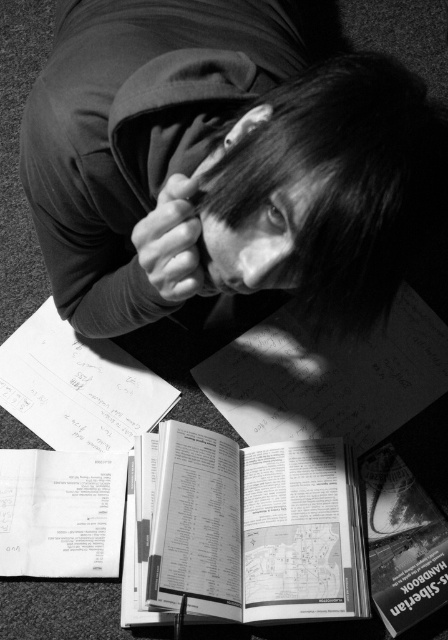
Question: Can you confirm if smooth hair at center is positioned below paperback book at center?

Choices:
 (A) no
 (B) yes

Answer: (A)

Question: Which point is farther to the camera?

Choices:
 (A) smooth skin hand at center
 (B) white paper at lower left
 (C) smooth hair at center
 (D) white paper at center

Answer: (D)

Question: Is white paper at lower left below smooth skin hand at center?

Choices:
 (A) no
 (B) yes

Answer: (B)

Question: Does paperback book at center lie behind white paper at center?

Choices:
 (A) yes
 (B) no

Answer: (B)

Question: Which of the following is the closest to the observer?

Choices:
 (A) smooth hair at center
 (B) white paper at center
 (C) paperback book at center
 (D) black matte hair at upper center

Answer: (A)

Question: Which object is farther from the camera taking this photo?

Choices:
 (A) smooth skin hand at center
 (B) white paper at lower left
 (C) paperback book at center
 (D) smooth hair at center

Answer: (B)